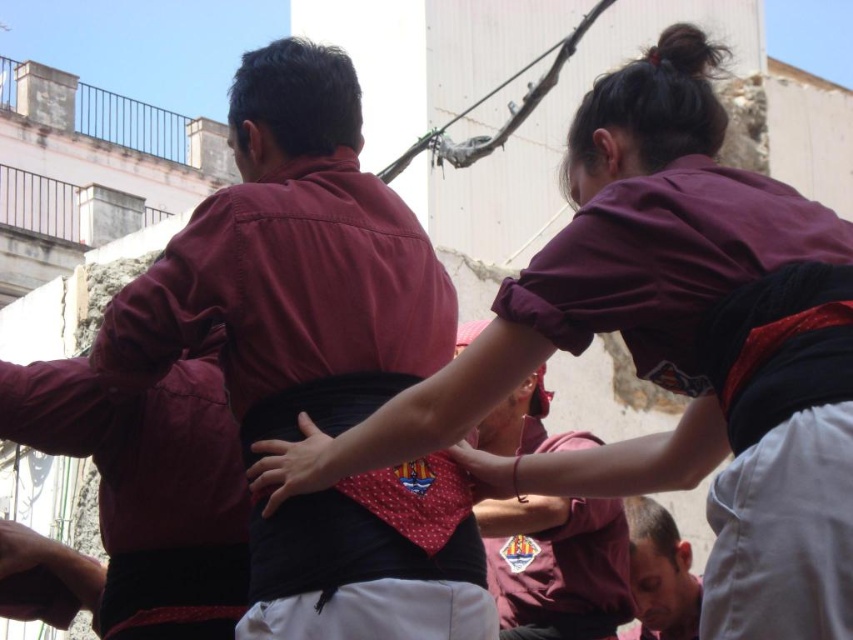
Between matte maroon shirt at upper center and polka dot fabric hand at center, which one is positioned lower?

Positioned lower is polka dot fabric hand at center.

Identify the location of matte maroon shirt at upper center. This screenshot has width=853, height=640. (624, 276).

Where is `matte maroon shirt at upper center`? matte maroon shirt at upper center is located at coordinates (624, 276).

At what (x,y) coordinates should I click in order to perform the action: click on matte maroon shirt at upper center. Please return your answer as a coordinate pair (x, y). Looking at the image, I should click on (624, 276).

Does point (648, 541) come farther from viewer compared to point (454, 458)?

Yes, it is behind point (454, 458).

Who is more distant from viewer, (688, 586) or (500, 493)?

The point (688, 586) is more distant.

Find the location of a particular element. Image resolution: width=853 pixels, height=640 pixels. smooth skin face at lower center is located at coordinates (660, 573).

Locate an element on the screen. The width and height of the screenshot is (853, 640). smooth skin face at lower center is located at coordinates (660, 573).

Is point (477, 326) behind point (637, 586)?

Yes.

Based on the photo, who is positioned more to the right, maroon fabric shirt at center or smooth skin face at lower center?

Positioned to the right is smooth skin face at lower center.

Which is behind, point (534, 547) or point (648, 621)?

The point (648, 621) is more distant.

You are a GUI agent. You are given a task and a screenshot of the screen. Output one action in this format:
    pyautogui.click(x=<x>, y=<y>)
    Task: Click on the maroon fabric shirt at center
    This screenshot has height=640, width=853.
    Given the screenshot: What is the action you would take?
    pos(556,566)